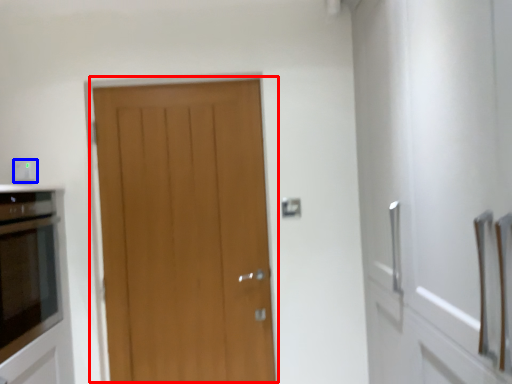
Question: Among these objects, which one is farthest to the camera, door (highlighted by a red box) or electric outlet (highlighted by a blue box)?

Choices:
 (A) door
 (B) electric outlet

Answer: (A)